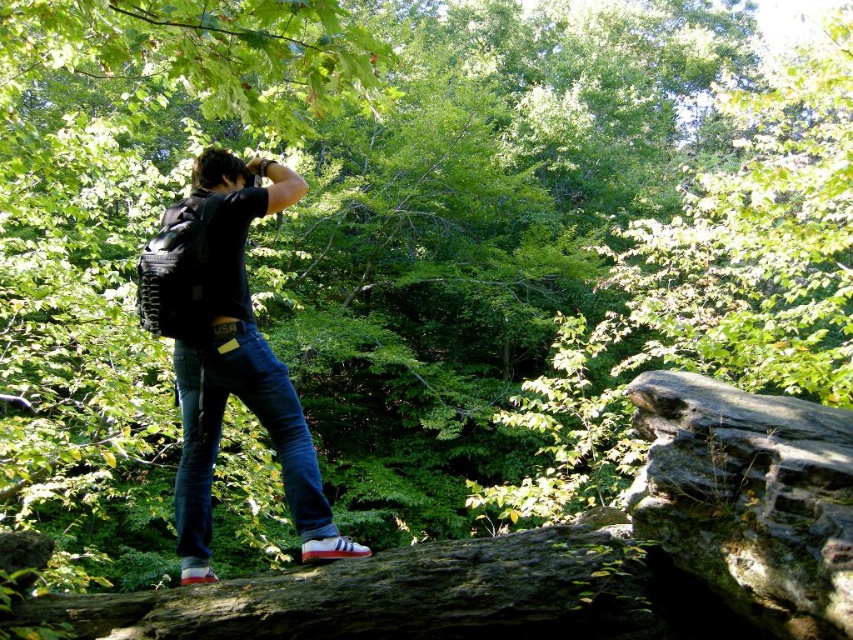
You are a photographer trying to capture a wide landscape shot. You need to ensure that both the brown rough tree trunk at lower center and the blue denim jeans at center are visible in the frame. Given their sizes, which object will occupy more of the camera view?

The brown rough tree trunk at lower center will occupy more of the camera view because it has a larger size compared to the blue denim jeans at center.

You are a photographer trying to capture a photo of the brown rough tree trunk at lower center while standing on the denim jeans at center. Since the tree trunk is on the right side of your jeans, where should you move your body to get the tree trunk centered in your camera frame?

The brown rough tree trunk at lower center is positioned on the right side of denim jeans at center, so you should move your body to the left to center the tree trunk in your camera frame.

You are trying to decide whether to sit on the brown rough tree trunk at lower center or the blue denim jeans at center. Which one is wider?

The brown rough tree trunk at lower center is wider than the blue denim jeans at center.